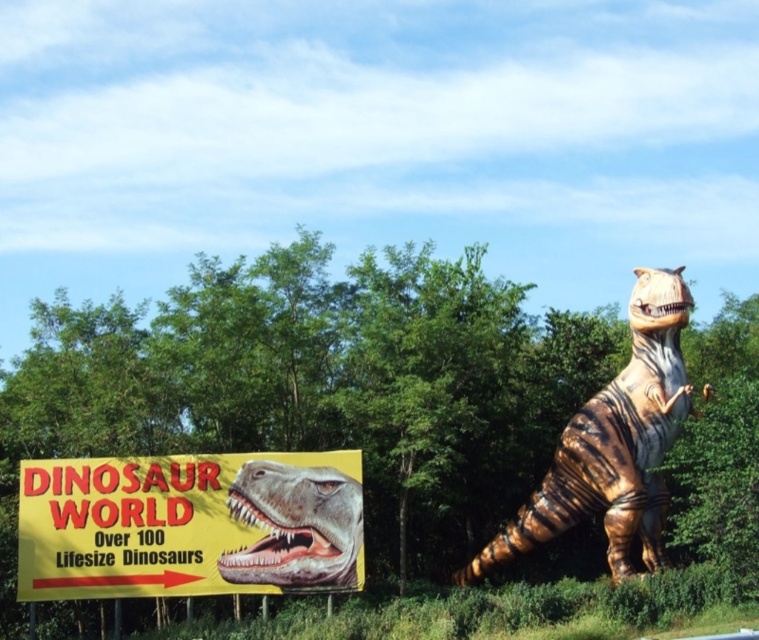
Who is more distant from viewer, (632,444) or (348,570)?

The point (632,444) is behind.

Does striped metallic dinosaur at center have a greater height compared to shiny metallic dinosaur head at center?

Correct, striped metallic dinosaur at center is much taller as shiny metallic dinosaur head at center.

Measure the distance between point [669,408] and camera.

Point [669,408] is 81.37 meters away from camera.

This screenshot has height=640, width=759. Identify the location of striped metallic dinosaur at center. (613, 444).

In the scene shown: Can you confirm if yellow paper sign at lower left is thinner than shiny metallic dinosaur head at center?

No.

Is yellow paper sign at lower left smaller than shiny metallic dinosaur head at center?

No.

Identify the location of yellow paper sign at lower left. The width and height of the screenshot is (759, 640). (189, 525).

Who is shorter, yellow paper sign at lower left or striped metallic dinosaur at center?

Standing shorter between the two is yellow paper sign at lower left.

Does yellow paper sign at lower left have a larger size compared to striped metallic dinosaur at center?

No, yellow paper sign at lower left is not bigger than striped metallic dinosaur at center.

Where is `yellow paper sign at lower left`? This screenshot has width=759, height=640. yellow paper sign at lower left is located at coordinates 189,525.